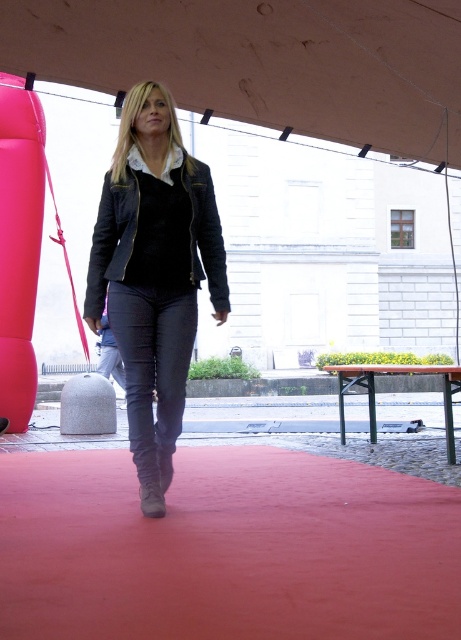
You are a photographer positioned at the entrance of the building. You want to capture a photo of the woman walking on the red carpet at center and the velvet black jacket at center. Which object should you focus on first to ensure both are in the frame?

The red carpet at center is in front of the velvet black jacket at center, so you should focus on the velvet black jacket at center first to ensure both are in the frame.

You are a photographer positioned to the side of the scene. You want to capture a clear shot of the dark gray denim jeans at center without the brown fabric canopy at upper center blocking the view. Is this possible?

The dark gray denim jeans at center is behind the brown fabric canopy at upper center, so the canopy would block the view. To get a clear shot, you need to adjust your angle or move closer to ensure the jeans are in front of the canopy.